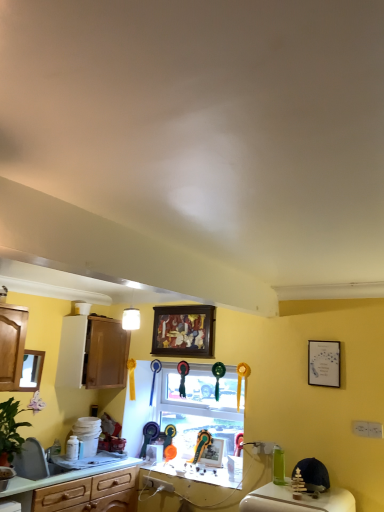
Question: Is green laminate countertop at lower left smaller than white glossy countertop at center?

Choices:
 (A) yes
 (B) no

Answer: (B)

Question: Is green laminate countertop at lower left far away from white glossy countertop at center?

Choices:
 (A) no
 (B) yes

Answer: (A)

Question: Is green laminate countertop at lower left shorter than white glossy countertop at center?

Choices:
 (A) yes
 (B) no

Answer: (B)

Question: Is green laminate countertop at lower left bigger than white glossy countertop at center?

Choices:
 (A) yes
 (B) no

Answer: (A)

Question: From the image's perspective, is green laminate countertop at lower left on top of white glossy countertop at center?

Choices:
 (A) no
 (B) yes

Answer: (B)

Question: Considering the positions of green laminate countertop at lower left and white glossy sink at lower left in the image, is green laminate countertop at lower left bigger or smaller than white glossy sink at lower left?

Choices:
 (A) small
 (B) big

Answer: (B)

Question: Based on their positions, is green laminate countertop at lower left located to the left or right of white glossy sink at lower left?

Choices:
 (A) right
 (B) left

Answer: (A)

Question: From the image's perspective, relative to white glossy sink at lower left, is green laminate countertop at lower left above or below?

Choices:
 (A) below
 (B) above

Answer: (A)

Question: Looking at their shapes, would you say green laminate countertop at lower left is wider or thinner than white glossy sink at lower left?

Choices:
 (A) thin
 (B) wide

Answer: (B)

Question: From the image's perspective, is clear glass window at center positioned above or below white matte picture frame at upper right, the first picture frame from the front?

Choices:
 (A) below
 (B) above

Answer: (A)

Question: Is clear glass window at center inside or outside of white matte picture frame at upper right, the fourth picture frame from the left?

Choices:
 (A) inside
 (B) outside

Answer: (B)

Question: Considering the positions of clear glass window at center and white matte picture frame at upper right, which is the first picture frame in right-to-left order, in the image, is clear glass window at center wider or thinner than white matte picture frame at upper right, which is the first picture frame in right-to-left order,?

Choices:
 (A) thin
 (B) wide

Answer: (B)

Question: Does point (203, 414) appear closer or farther from the camera than point (307, 366)?

Choices:
 (A) farther
 (B) closer

Answer: (A)

Question: Considering the relative positions of metallic silver picture frame at center, the 4th picture frame when ordered from top to bottom, and white glossy countertop at center in the image provided, is metallic silver picture frame at center, the 4th picture frame when ordered from top to bottom, to the left or to the right of white glossy countertop at center?

Choices:
 (A) right
 (B) left

Answer: (A)

Question: From the image's perspective, is metallic silver picture frame at center, the 1th picture frame when ordered from bottom to top, located above or below white glossy countertop at center?

Choices:
 (A) below
 (B) above

Answer: (B)